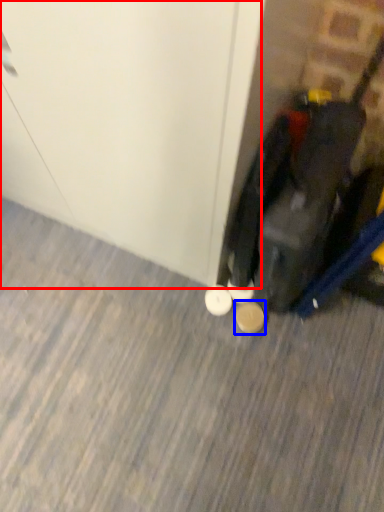
Question: Which point is closer to the camera, door (highlighted by a red box) or footwear (highlighted by a blue box)?

Choices:
 (A) door
 (B) footwear

Answer: (A)